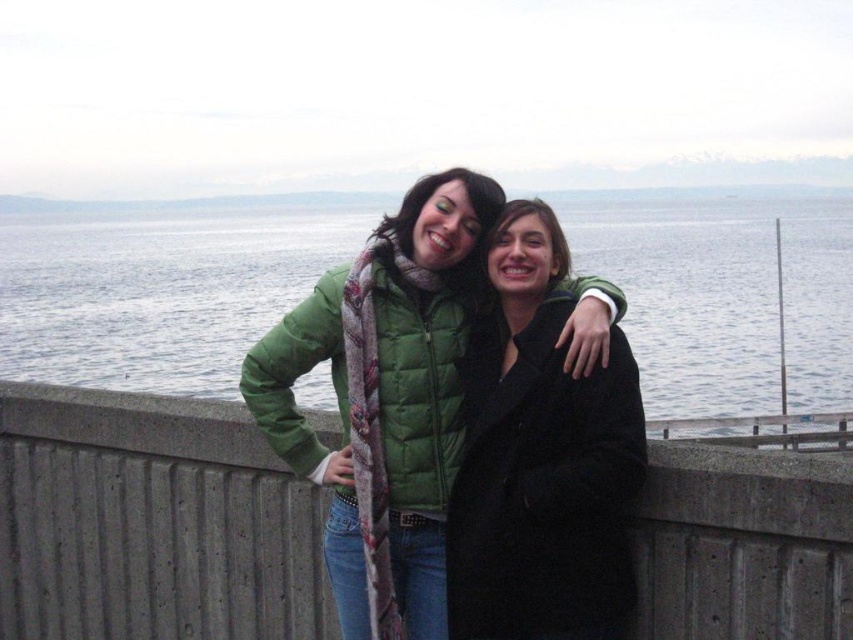
You are standing at the point marked as point [234,435] in the image. The person wearing a green puffer jacket and the person in black coat are both facing your direction. If you want to take a photo of them without being in the frame, which direction should you move to ensure you are out of the camera view?

Since you are 6.83 meters away from the point [234,435], you should move either behind the two people or to a side where they cannot see you, ensuring you are out of the camera view.

You are a photographer positioned behind the two people in the image. You want to take a photo that includes both the concrete at center and the black wool coat at center. Which object should you focus on first to ensure both are in sharp focus?

The concrete at center is closer to the viewer than the black wool coat at center. To ensure both are in sharp focus, you should focus on the concrete at center first, as it is the closer object.

You are standing between two people at the waterfront. You want to walk straight towards the clear blue water at center. Which direction should you move relative to the two people?

The clear blue water at center is located at point coordinates, so you should move forward between the two people to reach it.